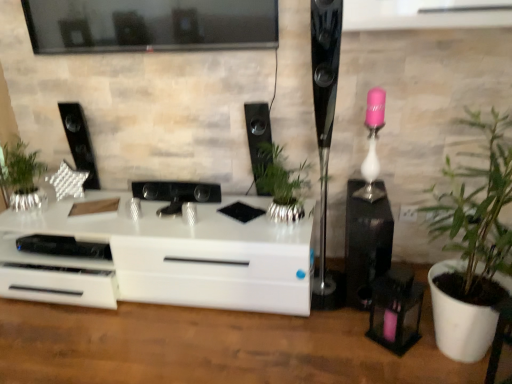
Where is `vacant area that is in front of black glossy speaker at center, which ranks as the 3th speaker in right-to-left order`? This screenshot has width=512, height=384. vacant area that is in front of black glossy speaker at center, which ranks as the 3th speaker in right-to-left order is located at coordinates (256, 216).